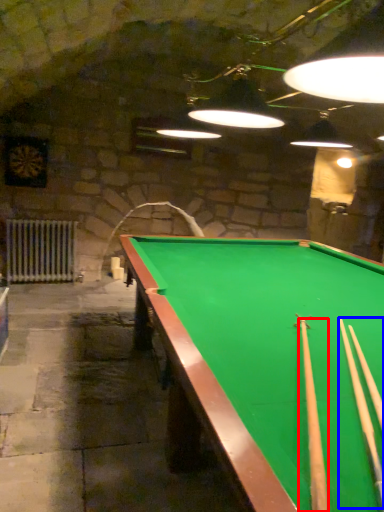
Question: Which object is further to the camera taking this photo, cue (highlighted by a red box) or cue (highlighted by a blue box)?

Choices:
 (A) cue
 (B) cue

Answer: (B)